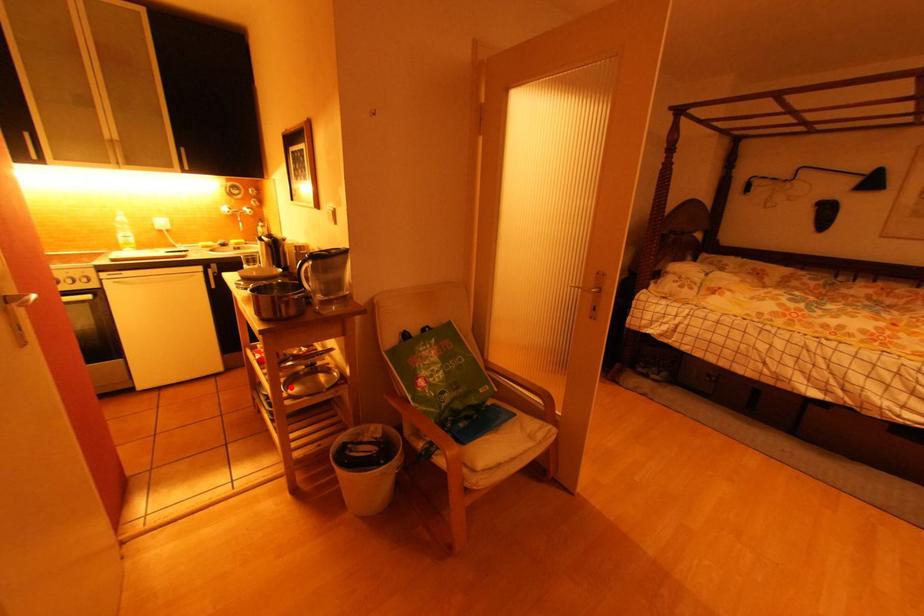
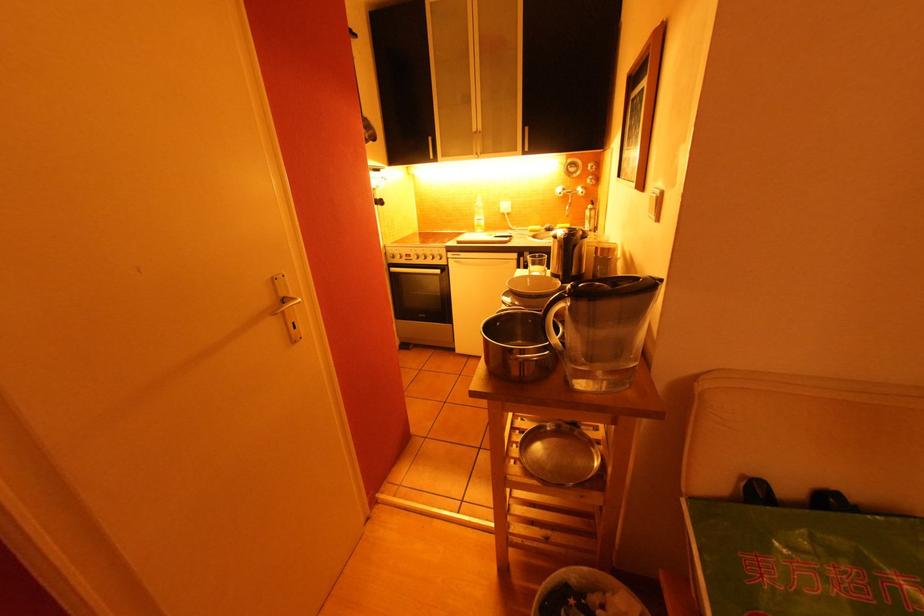
Question: I am providing you with two images of the same scene from different viewpoints. In image1, a red point is highlighted. Considering the same 3D point in image2, which of the following is correct?

Choices:
 (A) It is closer
 (B) It is farther

Answer: (B)